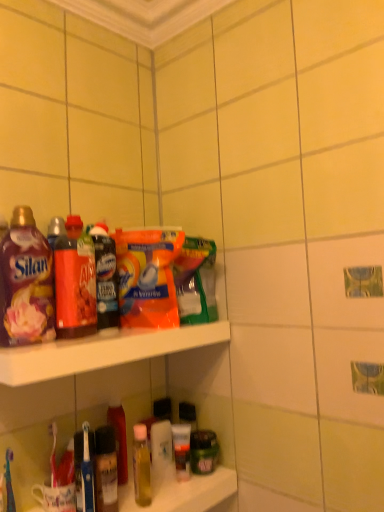
The image size is (384, 512). Identify the location of vacant region below orange plastic cleaning product at center (from a real-world perspective). (152, 327).